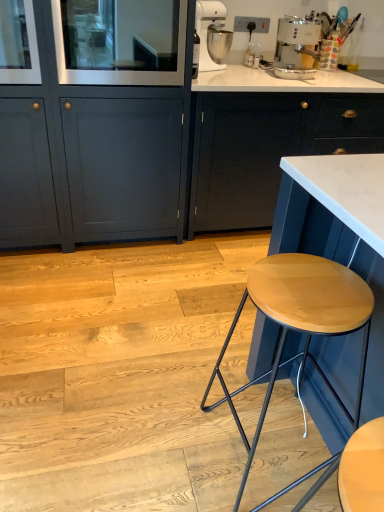
Question: Is white metallic stand mixer at upper center wider than matte dark blue cabinet at center, the 1th cabinetry when ordered from right to left?

Choices:
 (A) no
 (B) yes

Answer: (A)

Question: Is white metallic stand mixer at upper center bigger than matte dark blue cabinet at center, marked as the second cabinetry in a left-to-right arrangement?

Choices:
 (A) yes
 (B) no

Answer: (B)

Question: Is white metallic stand mixer at upper center at the right side of matte dark blue cabinet at center, the 1th cabinetry when ordered from right to left?

Choices:
 (A) no
 (B) yes

Answer: (A)

Question: Would you consider white metallic stand mixer at upper center to be distant from matte dark blue cabinet at center, the 1th cabinetry when ordered from right to left?

Choices:
 (A) yes
 (B) no

Answer: (B)

Question: Could you tell me if white metallic stand mixer at upper center is facing matte dark blue cabinet at center, marked as the second cabinetry in a left-to-right arrangement?

Choices:
 (A) no
 (B) yes

Answer: (A)

Question: Is wooden stool at right inside the boundaries of white metallic stand mixer at upper center, or outside?

Choices:
 (A) outside
 (B) inside

Answer: (A)

Question: From the image's perspective, is wooden stool at right located above or below white metallic stand mixer at upper center?

Choices:
 (A) below
 (B) above

Answer: (A)

Question: Is wooden stool at right in front of or behind white metallic stand mixer at upper center in the image?

Choices:
 (A) behind
 (B) front

Answer: (B)

Question: Looking at their shapes, would you say wooden stool at right is wider or thinner than white metallic stand mixer at upper center?

Choices:
 (A) thin
 (B) wide

Answer: (B)

Question: Is white metallic stand mixer at upper center taller or shorter than matte gray cabinet at lower left, positioned as the 1th cabinetry in left-to-right order?

Choices:
 (A) short
 (B) tall

Answer: (A)

Question: Considering the relative positions of white metallic stand mixer at upper center and matte gray cabinet at lower left, positioned as the 1th cabinetry in left-to-right order, in the image provided, is white metallic stand mixer at upper center to the left or to the right of matte gray cabinet at lower left, positioned as the 1th cabinetry in left-to-right order,?

Choices:
 (A) right
 (B) left

Answer: (A)

Question: Is white metallic stand mixer at upper center situated inside matte gray cabinet at lower left, positioned as the 1th cabinetry in left-to-right order, or outside?

Choices:
 (A) outside
 (B) inside

Answer: (A)

Question: Considering the positions of white metallic stand mixer at upper center and matte gray cabinet at lower left, placed as the second cabinetry when sorted from right to left, in the image, is white metallic stand mixer at upper center bigger or smaller than matte gray cabinet at lower left, placed as the second cabinetry when sorted from right to left,?

Choices:
 (A) small
 (B) big

Answer: (A)

Question: From a real-world perspective, relative to clear glass door at upper left, is matte dark blue cabinet at center, the 1th cabinetry when ordered from right to left, vertically above or below?

Choices:
 (A) below
 (B) above

Answer: (A)

Question: Based on their sizes in the image, would you say matte dark blue cabinet at center, the 1th cabinetry when ordered from right to left, is bigger or smaller than clear glass door at upper left?

Choices:
 (A) big
 (B) small

Answer: (A)